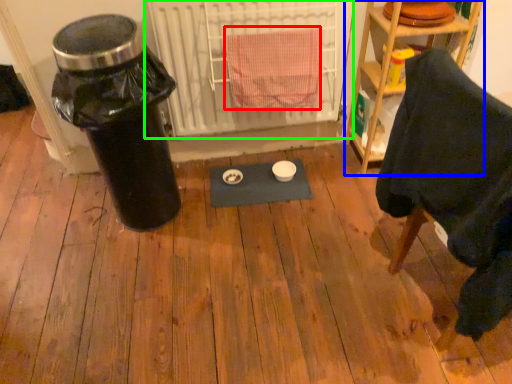
Question: Based on their relative distances, which object is nearer to bath towel (highlighted by a red box)? Choose from shelf (highlighted by a blue box) and radiator (highlighted by a green box).

Choices:
 (A) shelf
 (B) radiator

Answer: (B)